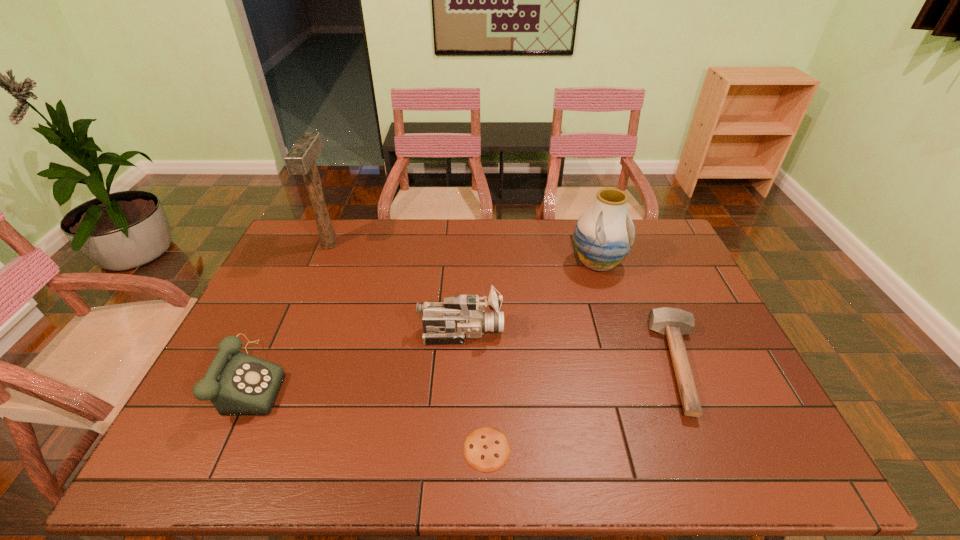
You are a GUI agent. You are given a task and a screenshot of the screen. Output one action in this format:
    pyautogui.click(x=<x>, y=<y>)
    Task: Click on the object located in the right edge section of the desktop
    This screenshot has height=540, width=960.
    Given the screenshot: What is the action you would take?
    pyautogui.click(x=674, y=322)

You are a GUI agent. You are given a task and a screenshot of the screen. Output one action in this format:
    pyautogui.click(x=<x>, y=<y>)
    Task: Click on the object present at the far left corner
    The height and width of the screenshot is (540, 960).
    Given the screenshot: What is the action you would take?
    pyautogui.click(x=300, y=160)

I want to click on vacant region at the far edge, so click(467, 241).

Image resolution: width=960 pixels, height=540 pixels. Identify the location of free space at the near edge of the desktop. (621, 453).

What are the coordinates of `vacant space at the right edge` in the screenshot? It's located at (723, 365).

The height and width of the screenshot is (540, 960). In the image, there is a desktop. In order to click on vacant space at the near left corner in this screenshot , I will do `click(184, 448)`.

Identify the location of vacant area at the far right corner. Image resolution: width=960 pixels, height=540 pixels. (665, 242).

I want to click on free location at the near right corner, so click(776, 470).

The width and height of the screenshot is (960, 540). I want to click on free space that is in between the vase and the farther mallet, so click(x=464, y=254).

You are a GUI agent. You are given a task and a screenshot of the screen. Output one action in this format:
    pyautogui.click(x=<x>, y=<y>)
    Task: Click on the unoccupied position between the fifth shortest object and the right mallet
    
    Given the screenshot: What is the action you would take?
    pyautogui.click(x=640, y=314)